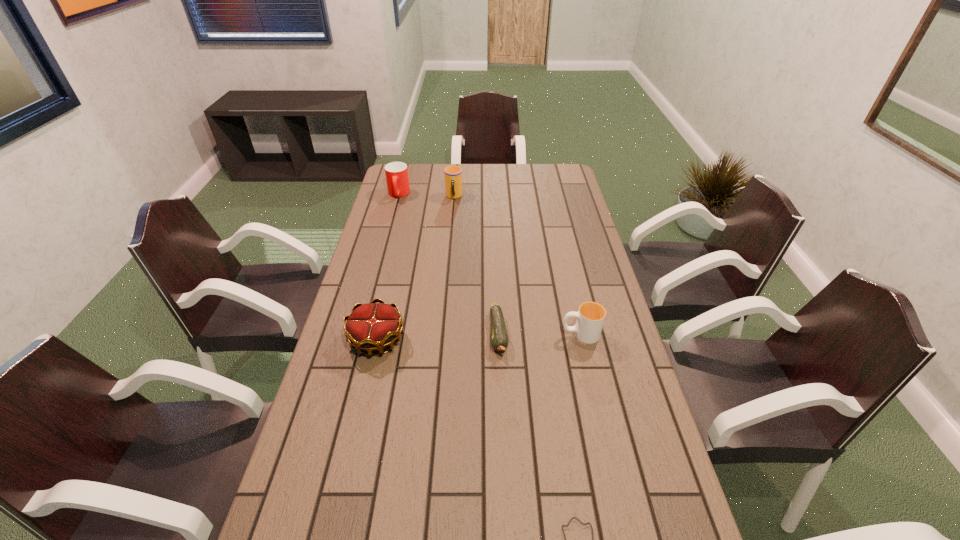
Identify which object is the fifth closest to the shortest object. Please provide its 2D coordinates. Your answer should be formatted as a tuple, i.e. [(x, y)], where the tuple contains the x and y coordinates of a point satisfying the conditions above.

[(397, 179)]

Where is `cup object that ranks as the closest to the nearest cup`? cup object that ranks as the closest to the nearest cup is located at coordinates (453, 174).

Locate an element on the screen. This screenshot has width=960, height=540. cup that is the third closest to the shortest object is located at coordinates (397, 179).

Locate an element on the screen. This screenshot has width=960, height=540. free point that satisfies the following two spatial constraints: 1. with the handle on the side of the shortest cup; 2. on the side of the leftmost cup with the handle is located at coordinates [x=549, y=194].

The image size is (960, 540). Identify the location of free region that satisfies the following two spatial constraints: 1. at the blossom end of the shortest object; 2. with the handle on the side of the nearest cup. (498, 334).

The image size is (960, 540). I want to click on blank area in the image that satisfies the following two spatial constraints: 1. at the blossom end of the zucchini; 2. with the handle on the side of the nearest cup, so click(498, 334).

This screenshot has width=960, height=540. I want to click on vacant point that satisfies the following two spatial constraints: 1. with the handle on the side of the rightmost cup; 2. on the side of the leftmost cup with the handle, so click(549, 194).

Find the location of `free space that satisfies the following two spatial constraints: 1. with the handle on the side of the shortest cup; 2. at the blossom end of the shortest object`. free space that satisfies the following two spatial constraints: 1. with the handle on the side of the shortest cup; 2. at the blossom end of the shortest object is located at coordinates (580, 334).